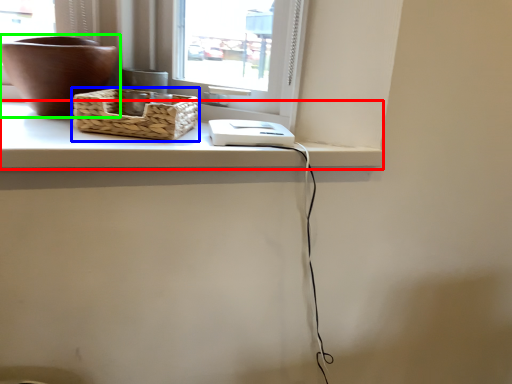
Question: Which object is positioned closest to counter top (highlighted by a red box)? Select from picnic basket (highlighted by a blue box) and flowerpot (highlighted by a green box).

Choices:
 (A) picnic basket
 (B) flowerpot

Answer: (A)